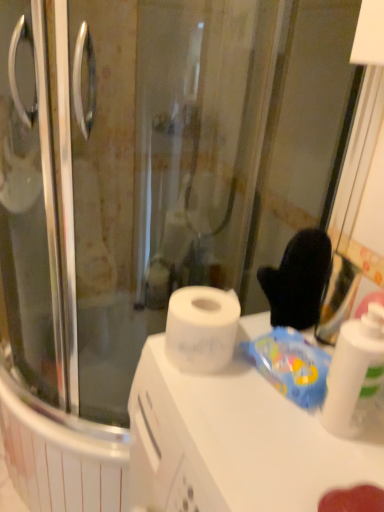
Image resolution: width=384 pixels, height=512 pixels. Describe the element at coordinates (355, 373) in the screenshot. I see `white glossy bottle at right` at that location.

What is the approximate width of blue plastic bag at upper right?

The width of blue plastic bag at upper right is 4.68 inches.

At what (x,y) coordinates should I click in order to perform the action: click on white matte counter top at center. Please return your answer as a coordinate pair (x, y). Image resolution: width=384 pixels, height=512 pixels. Looking at the image, I should click on (235, 442).

Would you consider white glossy bottle at right to be distant from white matte counter top at center?

No, white glossy bottle at right is not far from white matte counter top at center.

Image resolution: width=384 pixels, height=512 pixels. Find the location of `cleaning product on the right of white matte counter top at center`. cleaning product on the right of white matte counter top at center is located at coordinates pos(355,373).

Between white glossy bottle at right and white matte counter top at center, which one has smaller width?

Thinner between the two is white glossy bottle at right.

Is white glossy bottle at right looking in the opposite direction of white matte counter top at center?

No, white glossy bottle at right is not facing away from white matte counter top at center.

Is white glossy bottle at right thinner than blue plastic bag at upper right?

Yes.

In the scene shown: Is white glossy bottle at right facing towards blue plastic bag at upper right?

No.

The height and width of the screenshot is (512, 384). What are the coordinates of `food behind the white glossy bottle at right` in the screenshot? It's located at (290, 365).

Does blue plastic bag at upper right lie in front of white glossy bottle at right?

No, it is not.

From the image's perspective, is blue plastic bag at upper right positioned above or below white glossy bottle at right?

blue plastic bag at upper right is below white glossy bottle at right.

Looking at their sizes, would you say blue plastic bag at upper right is wider or thinner than white glossy bottle at right?

Considering their sizes, blue plastic bag at upper right looks broader than white glossy bottle at right.

Is white matte counter top at center looking in the opposite direction of white glossy bottle at right?

No, white matte counter top at center is not facing away from white glossy bottle at right.

Is white matte counter top at center directly adjacent to white glossy bottle at right?

white matte counter top at center and white glossy bottle at right are not in contact.

Which of these two, white matte counter top at center or white glossy bottle at right, is thinner?

white glossy bottle at right is thinner.

Considering the relative sizes of white matte counter top at center and white glossy bottle at right in the image provided, is white matte counter top at center shorter than white glossy bottle at right?

In fact, white matte counter top at center may be taller than white glossy bottle at right.

Which is more to the left, white matte counter top at center or blue plastic bag at upper right?

Positioned to the left is white matte counter top at center.

Is white matte counter top at center turned away from blue plastic bag at upper right?

No, white matte counter top at center's orientation is not away from blue plastic bag at upper right.

From a real-world perspective, who is located higher, white matte counter top at center or blue plastic bag at upper right?

blue plastic bag at upper right, from a real-world perspective.

How much distance is there between white matte counter top at center and blue plastic bag at upper right?

The distance of white matte counter top at center from blue plastic bag at upper right is 4.78 inches.

Based on the photo, is blue plastic bag at upper right completely or partially outside of white matte counter top at center?

That's correct, blue plastic bag at upper right is outside of white matte counter top at center.

Is point (297, 400) in front of point (273, 443)?

No.

I want to click on counter top located in front of the blue plastic bag at upper right, so click(235, 442).

Is the position of blue plastic bag at upper right less distant than that of white matte counter top at center?

No, it is behind white matte counter top at center.

Locate an element on the screen. cleaning product that appears above the white matte counter top at center (from the image's perspective) is located at coordinates (355, 373).

Image resolution: width=384 pixels, height=512 pixels. I want to click on cleaning product above the blue plastic bag at upper right (from a real-world perspective), so click(x=355, y=373).

From the image, which object appears to be nearer to white glossy bottle at right, white matte counter top at center or blue plastic bag at upper right?

blue plastic bag at upper right is closer to white glossy bottle at right.

Based on the photo, considering their positions, is blue plastic bag at upper right positioned closer to white matte counter top at center than white glossy bottle at right?

Among the two, blue plastic bag at upper right is located nearer to white matte counter top at center.

Considering their positions, is blue plastic bag at upper right positioned further to white glossy bottle at right than white matte counter top at center?

white matte counter top at center lies further to white glossy bottle at right than the other object.

Looking at the image, which one is located further to blue plastic bag at upper right, white glossy bottle at right or white matte counter top at center?

white matte counter top at center lies further to blue plastic bag at upper right than the other object.

Looking at this image, from the image, which object appears to be farther from white matte counter top at center, white glossy bottle at right or blue plastic bag at upper right?

white glossy bottle at right is further to white matte counter top at center.

When comparing their distances from blue plastic bag at upper right, does white matte counter top at center or white glossy bottle at right seem further?

white matte counter top at center is positioned further to the anchor blue plastic bag at upper right.

Identify the location of food between white glossy bottle at right and white matte counter top at center vertically. (290, 365).